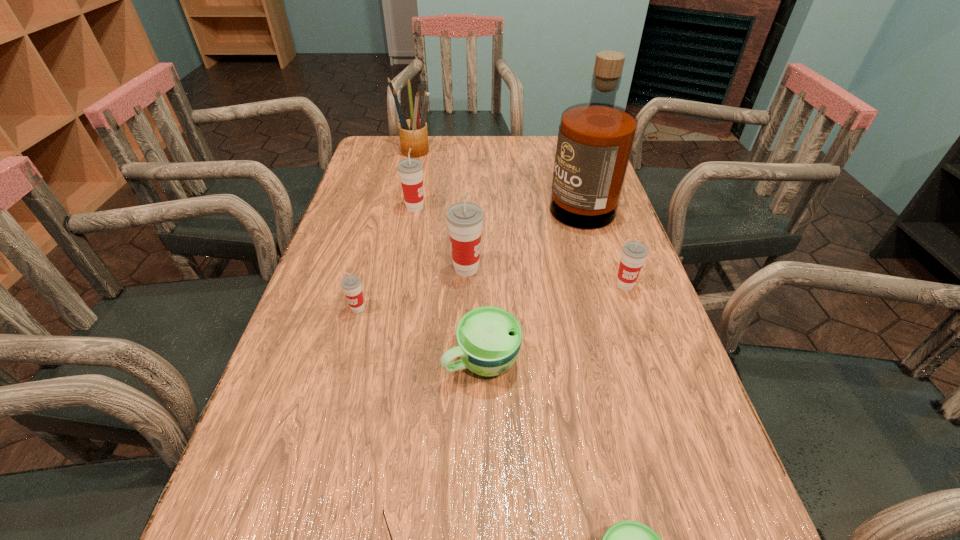
The height and width of the screenshot is (540, 960). What are the coordinates of `liquor` in the screenshot? It's located at (595, 140).

Identify the location of the farthest object. This screenshot has height=540, width=960. (413, 133).

Where is `brown pencil box`? The image size is (960, 540). brown pencil box is located at coordinates (413, 133).

The height and width of the screenshot is (540, 960). In order to click on the third red cup from left to right in this screenshot , I will do `click(465, 219)`.

The width and height of the screenshot is (960, 540). Find the location of `the tallest cup`. the tallest cup is located at coordinates (465, 219).

Locate an element on the screen. Image resolution: width=960 pixels, height=540 pixels. the sixth shortest object is located at coordinates click(x=410, y=170).

In order to click on the farthest red cup in this screenshot , I will do `click(410, 170)`.

Find the location of a particular element. the fifth tallest object is located at coordinates (634, 253).

Locate an element on the screen. This screenshot has width=960, height=540. the second smallest red cup is located at coordinates (634, 253).

Find the location of a particular element. The image size is (960, 540). the fourth farthest cup is located at coordinates [351, 284].